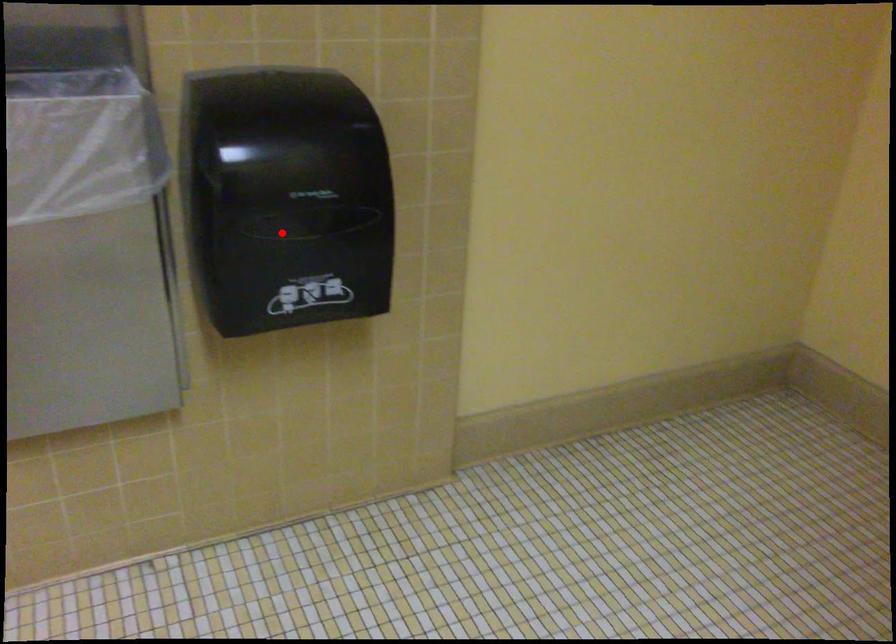
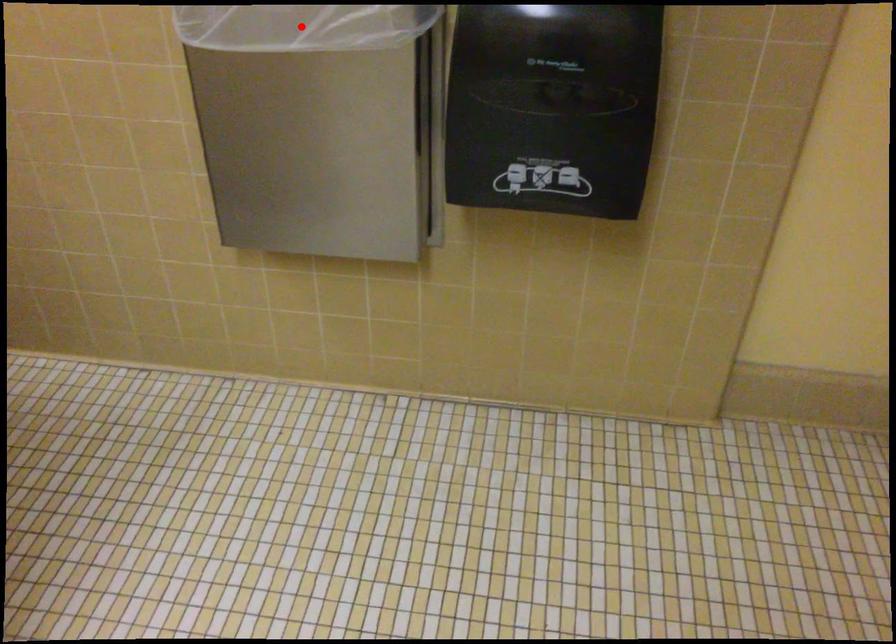
I am providing you with two images of the same scene from different viewpoints. A red point is marked on the first image and another point is marked on the second image. Is the red point in image1 aligned with the point shown in image2?

No